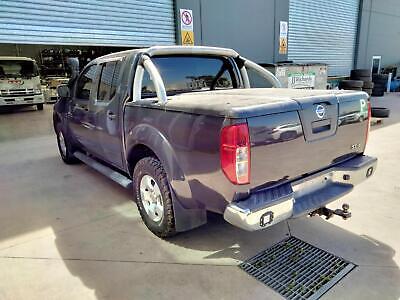
I want to click on back window, so coord(202,75).